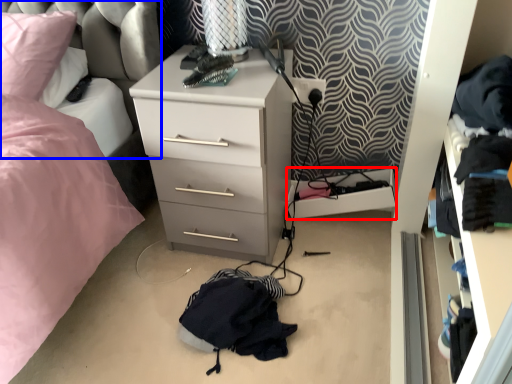
Question: Which of the following is the closest to the observer, shelf (highlighted by a red box) or swivel chair (highlighted by a blue box)?

Choices:
 (A) shelf
 (B) swivel chair

Answer: (B)